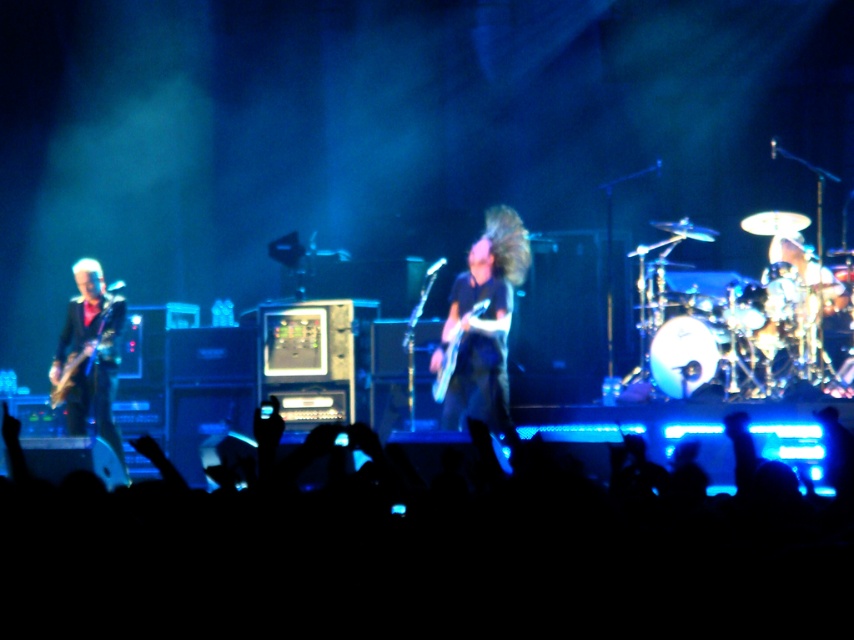
Question: Which is nearer to the shiny black electric guitar at left?

Choices:
 (A) shiny black guitar at left
 (B) shiny metallic guitar at center

Answer: (A)

Question: Which point is closer to the camera taking this photo?

Choices:
 (A) (71, 362)
 (B) (97, 362)
 (C) (32, 561)
 (D) (443, 374)

Answer: (C)

Question: Considering the relative positions of black silhouettes at lower center and shiny black guitar at left in the image provided, where is black silhouettes at lower center located with respect to shiny black guitar at left?

Choices:
 (A) above
 (B) below

Answer: (B)

Question: Does black silhouettes at lower center appear on the left side of shiny black guitar at left?

Choices:
 (A) yes
 (B) no

Answer: (B)

Question: Which of the following is the farthest from the observer?

Choices:
 (A) (68, 323)
 (B) (759, 634)
 (C) (75, 369)

Answer: (A)

Question: Is black silhouettes at lower center closer to camera compared to shiny black guitar at left?

Choices:
 (A) no
 (B) yes

Answer: (B)